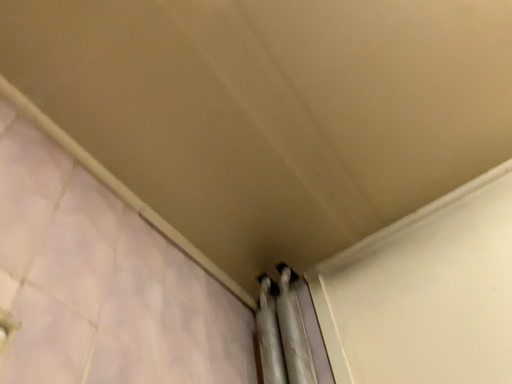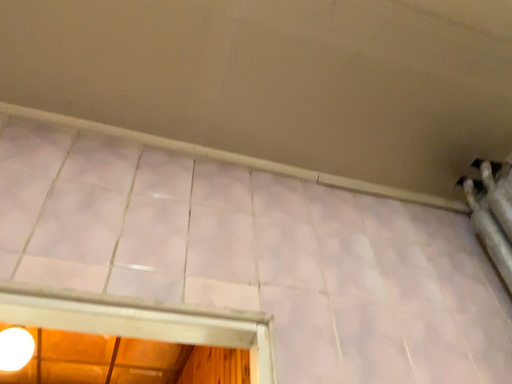
Question: How did the camera likely rotate when shooting the video?

Choices:
 (A) rotated left
 (B) rotated right

Answer: (A)